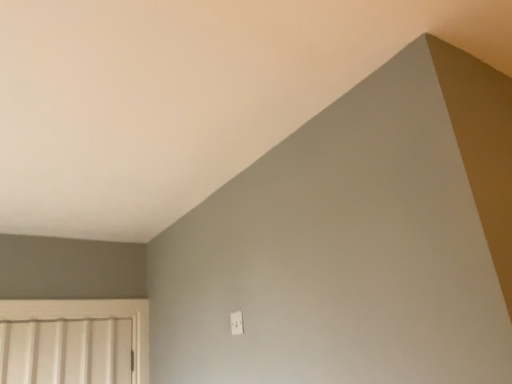
Where is `white plastic electric outlet at lower center`? This screenshot has width=512, height=384. white plastic electric outlet at lower center is located at coordinates (236, 323).

Describe the element at coordinates (236, 323) in the screenshot. I see `white plastic electric outlet at lower center` at that location.

What is the approximate height of white plastic electric outlet at lower center?

3.56 inches.

Locate an element on the screen. The height and width of the screenshot is (384, 512). white plastic electric outlet at lower center is located at coordinates (236, 323).